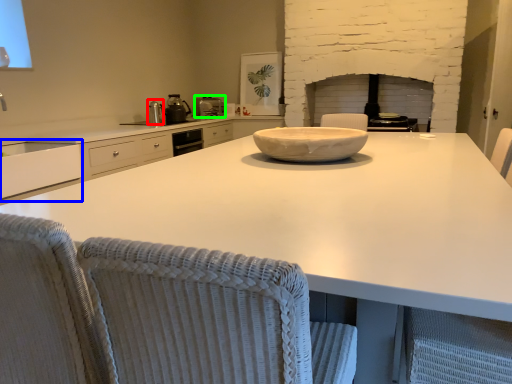
Question: Considering the real-world distances, which object is farthest from appliance (highlighted by a red box)? cabinetry (highlighted by a blue box) or kitchen appliance (highlighted by a green box)?

Choices:
 (A) cabinetry
 (B) kitchen appliance

Answer: (A)